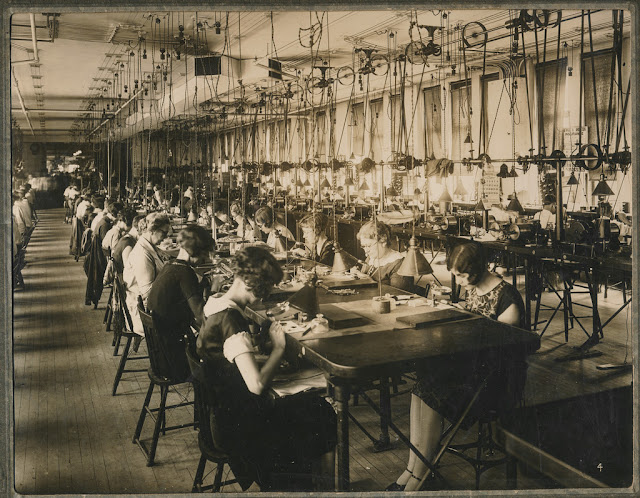
Identify the location of ceiling. Image resolution: width=640 pixels, height=498 pixels. (356, 25).